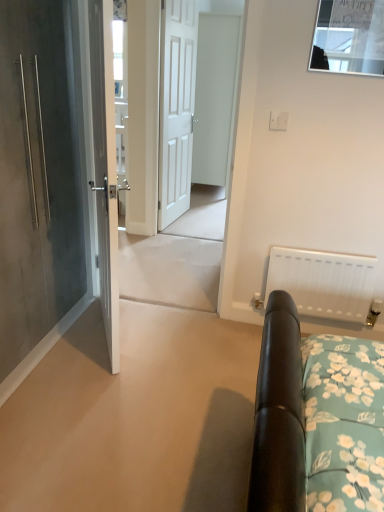
Describe the element at coordinates (176, 106) in the screenshot. This screenshot has width=384, height=512. I see `white matte door at center, the 3th door when ordered from left to right` at that location.

Where is `matte gray door at left, acting as the 1th door starting from the left`? matte gray door at left, acting as the 1th door starting from the left is located at coordinates (39, 173).

What do you see at coordinates (214, 96) in the screenshot? The height and width of the screenshot is (512, 384). I see `white matte door at center, which is the first door from right to left` at bounding box center [214, 96].

The image size is (384, 512). What do you see at coordinates (323, 282) in the screenshot? I see `white matte radiator at right` at bounding box center [323, 282].

Where is `white glossy door at center, positioned as the second door in left-to-right order`? This screenshot has width=384, height=512. white glossy door at center, positioned as the second door in left-to-right order is located at coordinates (105, 168).

Which object is wider, clear glass window at upper center or white wooden door at center?

white wooden door at center.

From a real-world perspective, is clear glass window at upper center under white wooden door at center?

No.

Between clear glass window at upper center and white wooden door at center, which one has more height?

With more height is white wooden door at center.

Which point is more distant from viewer, (x=354, y=17) or (x=200, y=17)?

The point (x=200, y=17) is behind.

Does point (349, 60) come closer to viewer compared to point (18, 163)?

No, it is not.

In the scene shown: Could you tell me if clear glass window at upper center is turned towards matte gray door at left, acting as the 1th door starting from the left?

No.

What's the angular difference between clear glass window at upper center and matte gray door at left, acting as the 1th door starting from the left,'s facing directions?

The angular difference between clear glass window at upper center and matte gray door at left, acting as the 1th door starting from the left, is 90.5 degrees.

Who is shorter, clear glass window at upper center or matte gray door at left, acting as the 1th door starting from the left?

With less height is clear glass window at upper center.

Does white matte radiator at right have a larger size compared to matte gray door at left, acting as the 1th door starting from the left?

Actually, white matte radiator at right might be smaller than matte gray door at left, acting as the 1th door starting from the left.

From the image's perspective, who appears lower, white matte radiator at right or matte gray door at left, acting as the 1th door starting from the left?

white matte radiator at right, from the image's perspective.

Considering the relative positions of white matte radiator at right and matte gray door at left, the 4th door viewed from the right, in the image provided, is white matte radiator at right to the left of matte gray door at left, the 4th door viewed from the right, from the viewer's perspective?

In fact, white matte radiator at right is to the right of matte gray door at left, the 4th door viewed from the right.

Is white wooden door at center oriented away from white glossy door at center, positioned as the second door in left-to-right order?

No, white wooden door at center's orientation is not away from white glossy door at center, positioned as the second door in left-to-right order.

Would you say white wooden door at center is a long distance from white glossy door at center, which is the 3th door from right to left?

white wooden door at center is far away from white glossy door at center, which is the 3th door from right to left.

Is point (202, 80) in front of point (109, 48)?

That is False.

Is white wooden door at center not within white glossy door at center, positioned as the second door in left-to-right order?

Indeed, white wooden door at center is completely outside white glossy door at center, positioned as the second door in left-to-right order.

In the scene shown: Could you tell me if white wooden door at center is facing white matte door at center, marked as the second door in a right-to-left arrangement?

No, white wooden door at center is not aimed at white matte door at center, marked as the second door in a right-to-left arrangement.

Looking at this image, would you consider white wooden door at center to be distant from white matte door at center, marked as the second door in a right-to-left arrangement?

No, white wooden door at center is in close proximity to white matte door at center, marked as the second door in a right-to-left arrangement.

Considering the sizes of white wooden door at center and white matte door at center, the 3th door when ordered from left to right, in the image, is white wooden door at center wider or thinner than white matte door at center, the 3th door when ordered from left to right,?

Clearly, white wooden door at center has less width compared to white matte door at center, the 3th door when ordered from left to right.

Is point (199, 80) closer or farther from the camera than point (180, 125)?

Point (199, 80) appears to be farther away from the viewer than point (180, 125).

From the image's perspective, which one is positioned lower, clear glass window at upper center or white matte radiator at right?

white matte radiator at right appears lower in the image.

In the scene shown: Is clear glass window at upper center turned away from white matte radiator at right?

That's not correct — clear glass window at upper center is not looking away from white matte radiator at right.

Is point (369, 65) farther from camera compared to point (342, 263)?

No, (369, 65) is in front of (342, 263).

Does clear glass window at upper center come behind white matte radiator at right?

No, clear glass window at upper center is closer to the viewer.

From the image's perspective, which object appears higher, white matte door at center, marked as the fourth door in a left-to-right arrangement, or white matte radiator at right?

white matte door at center, marked as the fourth door in a left-to-right arrangement, from the image's perspective.

Who is shorter, white matte door at center, marked as the fourth door in a left-to-right arrangement, or white matte radiator at right?

white matte radiator at right is shorter.

Is white matte radiator at right at the back of white matte door at center, which is the first door from right to left?

No, white matte door at center, which is the first door from right to left, is not facing away from white matte radiator at right.

This screenshot has height=512, width=384. In the image, there is a white wooden door at center. In order to click on window below it (from the image's perspective) in this screenshot , I will do `click(349, 37)`.

Where is `window above the matte gray door at left, the 4th door viewed from the right (from a real-world perspective)`? Image resolution: width=384 pixels, height=512 pixels. window above the matte gray door at left, the 4th door viewed from the right (from a real-world perspective) is located at coordinates (349, 37).

Based on their spatial positions, is white matte door at center, marked as the fourth door in a left-to-right arrangement, or white wooden door at center further from white glossy door at center, which is the 3th door from right to left?

white matte door at center, marked as the fourth door in a left-to-right arrangement.

Which object lies nearer to the anchor point matte gray door at left, acting as the 1th door starting from the left, white matte radiator at right or white matte door at center, marked as the fourth door in a left-to-right arrangement?

white matte radiator at right is closer to matte gray door at left, acting as the 1th door starting from the left.

Based on their spatial positions, is white wooden door at center or clear glass window at upper center closer to white matte radiator at right?

Among the two, clear glass window at upper center is located nearer to white matte radiator at right.

When comparing their distances from white glossy door at center, positioned as the second door in left-to-right order, does white matte door at center, which is the first door from right to left, or clear glass window at upper center seem closer?

clear glass window at upper center is closer to white glossy door at center, positioned as the second door in left-to-right order.

Considering their positions, is white matte radiator at right positioned further to white wooden door at center than matte gray door at left, the 4th door viewed from the right?

Based on the image, matte gray door at left, the 4th door viewed from the right, appears to be further to white wooden door at center.

From the picture: Looking at the image, which one is located closer to white matte radiator at right, white matte door at center, marked as the second door in a right-to-left arrangement, or white matte door at center, which is the first door from right to left?

The object closer to white matte radiator at right is white matte door at center, marked as the second door in a right-to-left arrangement.

Based on their spatial positions, is clear glass window at upper center or white glossy door at center, positioned as the second door in left-to-right order, closer to matte gray door at left, the 4th door viewed from the right?

white glossy door at center, positioned as the second door in left-to-right order, is positioned closer to the anchor matte gray door at left, the 4th door viewed from the right.

From the image, which object appears to be nearer to white matte door at center, which is the first door from right to left, white matte door at center, marked as the second door in a right-to-left arrangement, or white wooden door at center?

white wooden door at center is closer to white matte door at center, which is the first door from right to left.

Where is `door between white glossy door at center, positioned as the second door in left-to-right order, and white matte door at center, which is the first door from right to left, along the z-axis`? The width and height of the screenshot is (384, 512). door between white glossy door at center, positioned as the second door in left-to-right order, and white matte door at center, which is the first door from right to left, along the z-axis is located at coordinates (176, 106).

Where is `radiator located between matte gray door at left, acting as the 1th door starting from the left, and white wooden door at center in the depth direction`? This screenshot has height=512, width=384. radiator located between matte gray door at left, acting as the 1th door starting from the left, and white wooden door at center in the depth direction is located at coordinates (323, 282).

I want to click on screen door located between clear glass window at upper center and white matte door at center, the 3th door when ordered from left to right, in the depth direction, so click(206, 109).

Find the location of a particular element. The image size is (384, 512). window positioned between matte gray door at left, the 4th door viewed from the right, and white wooden door at center from near to far is located at coordinates (349, 37).